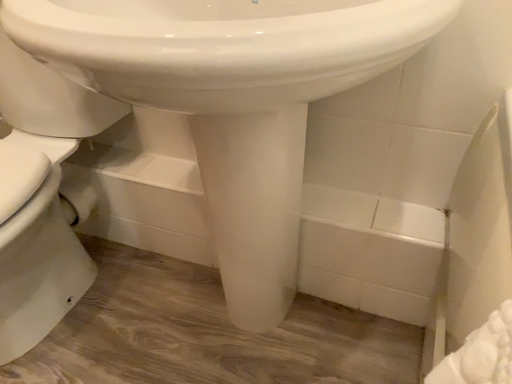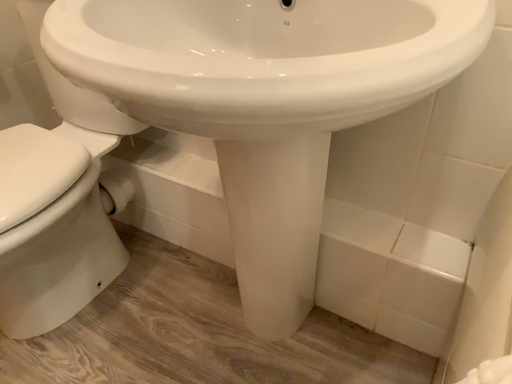
Question: Which way did the camera rotate in the video?

Choices:
 (A) rotated right
 (B) rotated left

Answer: (B)